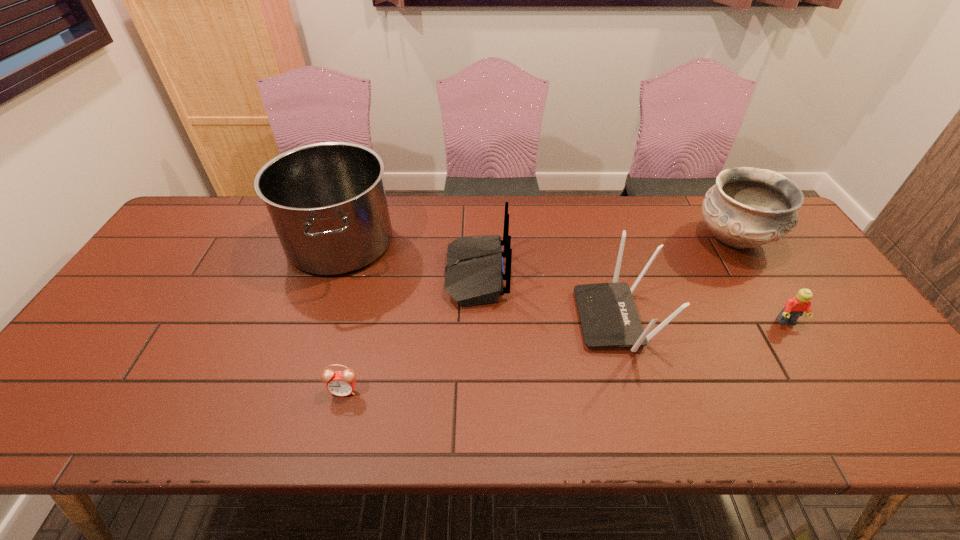
This screenshot has width=960, height=540. I want to click on vacant region located on the front-facing side of the right router, so click(x=555, y=319).

At what (x,y) coordinates should I click in order to perform the action: click on vacant position located on the front-facing side of the right router. Please return your answer as a coordinate pair (x, y). The height and width of the screenshot is (540, 960). Looking at the image, I should click on (559, 319).

Find the location of a particular element. vacant region located 0.170m on the front-facing side of the right router is located at coordinates (513, 319).

What are the coordinates of `vacant space located on the face of the Lego` in the screenshot? It's located at (857, 433).

Identify the location of free space located 0.060m on the clock face of the shortest object. (336, 423).

You are a GUI agent. You are given a task and a screenshot of the screen. Output one action in this format:
    pyautogui.click(x=<x>, y=<y>)
    Task: Click on the saucepan located in the far edge section of the desktop
    The width and height of the screenshot is (960, 540).
    Given the screenshot: What is the action you would take?
    (x=327, y=201)

Where is `pottery situated at the far edge`? pottery situated at the far edge is located at coordinates (747, 207).

What are the coordinates of `pottery that is at the right edge` in the screenshot? It's located at [x=747, y=207].

The width and height of the screenshot is (960, 540). I want to click on Lego at the right edge, so pos(795,307).

Locate an element on the screen. The width and height of the screenshot is (960, 540). object that is at the far right corner is located at coordinates (747, 207).